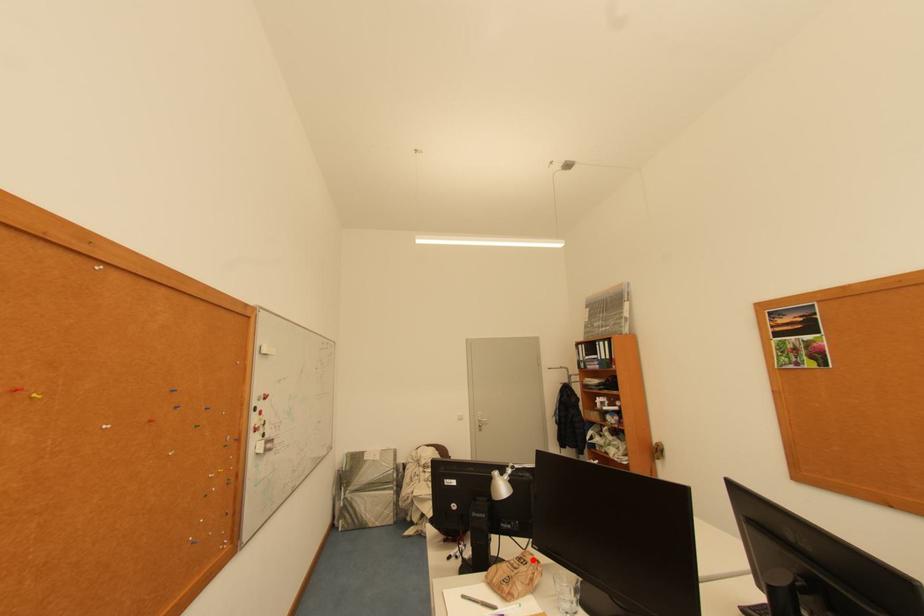
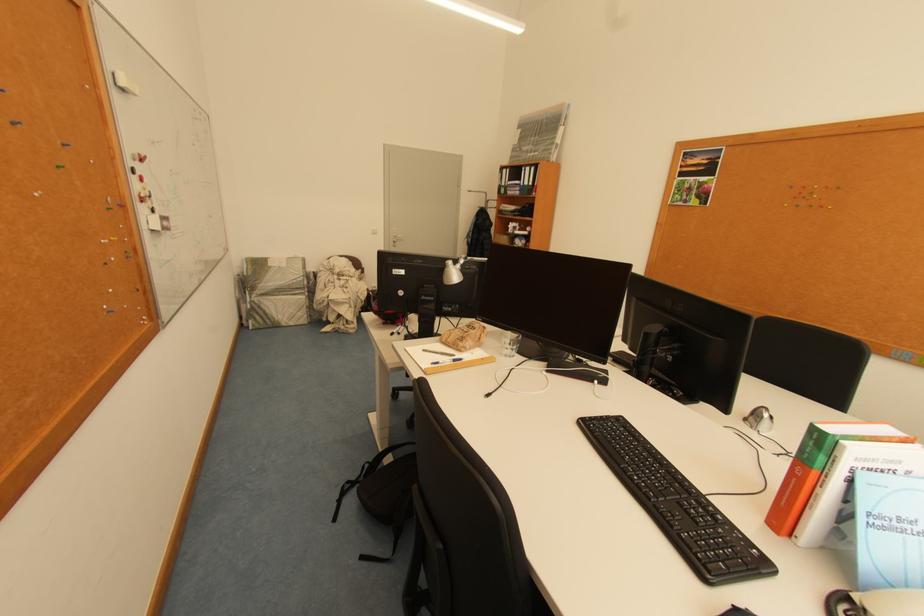
Question: A red point is marked in image1. In image2, is the corresponding 3D point closer to the camera or farther? Reply with the corresponding letter.

Choices:
 (A) The corresponding 3D point is closer.
 (B) The corresponding 3D point is farther.

Answer: (B)